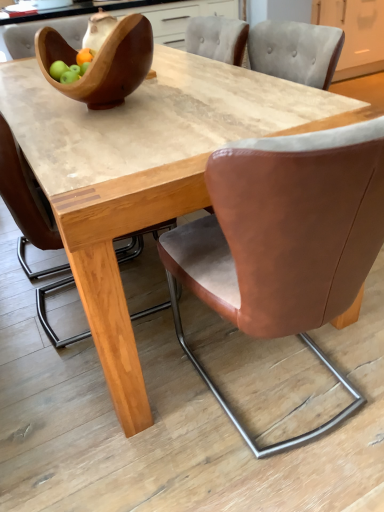
Question: Is matte gray cabinet at upper right positioned before wooden bowl at upper left?

Choices:
 (A) yes
 (B) no

Answer: (B)

Question: Does matte gray cabinet at upper right have a lesser height compared to wooden bowl at upper left?

Choices:
 (A) no
 (B) yes

Answer: (A)

Question: Is matte gray cabinet at upper right oriented away from wooden bowl at upper left?

Choices:
 (A) yes
 (B) no

Answer: (B)

Question: Is matte gray cabinet at upper right further to camera compared to wooden bowl at upper left?

Choices:
 (A) yes
 (B) no

Answer: (A)

Question: Can we say matte gray cabinet at upper right lies outside wooden bowl at upper left?

Choices:
 (A) yes
 (B) no

Answer: (A)

Question: Can you confirm if matte gray cabinet at upper right is taller than wooden bowl at upper left?

Choices:
 (A) no
 (B) yes

Answer: (B)

Question: From a real-world perspective, does brown leather chair at center, the second chair from the right, stand above brown leather chair at center, which ranks as the second chair in left-to-right order?

Choices:
 (A) no
 (B) yes

Answer: (B)

Question: Is brown leather chair at center, which appears as the 1th chair when viewed from the left, outside of brown leather chair at center, which ranks as the second chair in left-to-right order?

Choices:
 (A) yes
 (B) no

Answer: (A)

Question: Is brown leather chair at center, the second chair from the right, facing towards brown leather chair at center, the first chair viewed from the right?

Choices:
 (A) no
 (B) yes

Answer: (A)

Question: From the image's perspective, does brown leather chair at center, the second chair from the right, appear lower than brown leather chair at center, the first chair viewed from the right?

Choices:
 (A) yes
 (B) no

Answer: (B)

Question: Is brown leather chair at center, which appears as the 1th chair when viewed from the left, oriented away from brown leather chair at center, which ranks as the second chair in left-to-right order?

Choices:
 (A) no
 (B) yes

Answer: (A)

Question: From the image's perspective, is brown leather chair at center, which appears as the 1th chair when viewed from the left, over brown leather chair at center, the first chair viewed from the right?

Choices:
 (A) no
 (B) yes

Answer: (B)

Question: Can you confirm if wooden bowl at upper left is thinner than brown leather chair at center, the first chair viewed from the right?

Choices:
 (A) yes
 (B) no

Answer: (A)